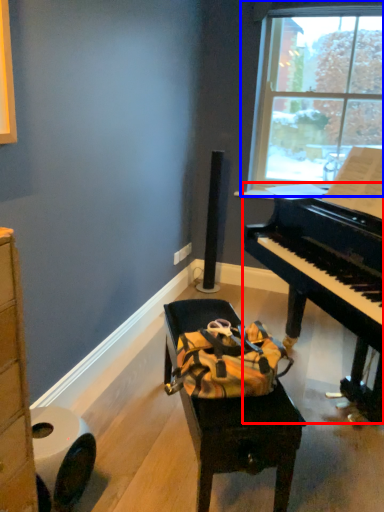
Question: Which object is closer to the camera taking this photo, piano (highlighted by a red box) or window (highlighted by a blue box)?

Choices:
 (A) piano
 (B) window

Answer: (A)